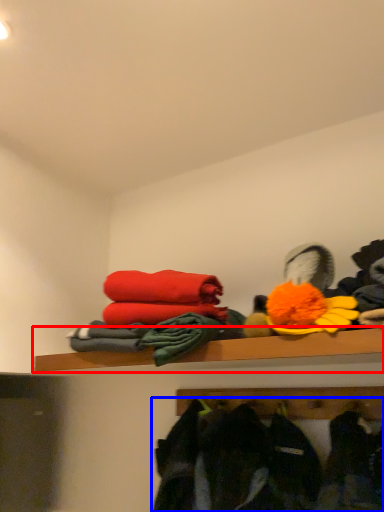
Question: Which object appears closest to the camera in this image, shelf (highlighted by a red box) or clothing (highlighted by a blue box)?

Choices:
 (A) shelf
 (B) clothing

Answer: (B)